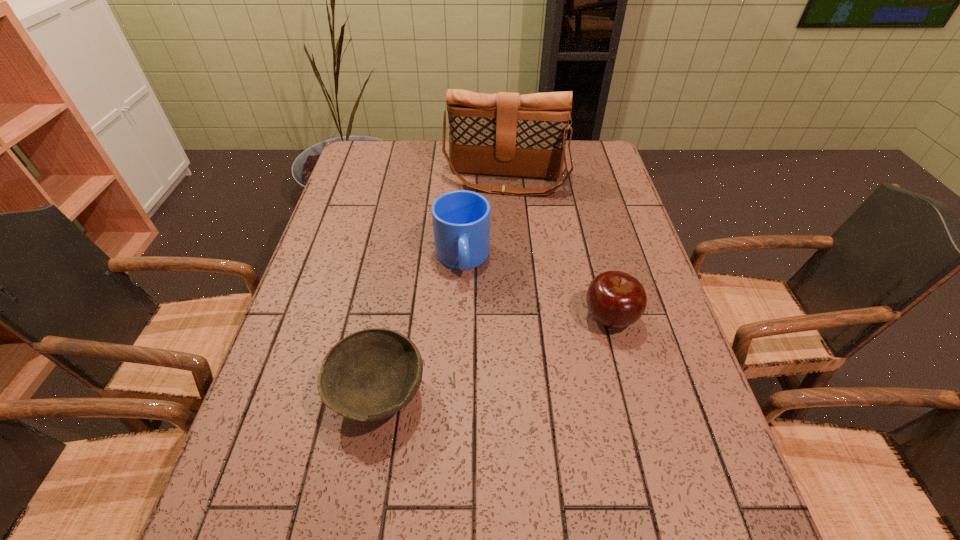
Locate an element on the screen. The width and height of the screenshot is (960, 540). vacant space at the left edge of the desktop is located at coordinates [x=318, y=309].

You are a GUI agent. You are given a task and a screenshot of the screen. Output one action in this format:
    pyautogui.click(x=<x>, y=<y>)
    Task: Click on the vacant region at the right edge of the desktop
    
    Given the screenshot: What is the action you would take?
    pyautogui.click(x=626, y=196)

In the image, there is a desktop. Where is `vacant space at the far left corner`? vacant space at the far left corner is located at coordinates (371, 176).

The image size is (960, 540). In the image, there is a desktop. In order to click on free space at the far right corner in this screenshot , I will do `click(567, 144)`.

Locate an element on the screen. The image size is (960, 540). vacant space that is in between the tallest object and the apple is located at coordinates (558, 248).

Find the location of a particular element. empty space between the shortest object and the apple is located at coordinates (494, 356).

Identify the location of vacant space that is in between the mug and the nearest object. This screenshot has height=540, width=960. (420, 326).

The image size is (960, 540). In order to click on free space that is in between the bowl and the third nearest object in this screenshot , I will do `click(420, 326)`.

The image size is (960, 540). I want to click on vacant area between the second farthest object and the second nearest object, so click(x=536, y=288).

In order to click on free space between the third farthest object and the shoulder bag in this screenshot , I will do `click(558, 248)`.